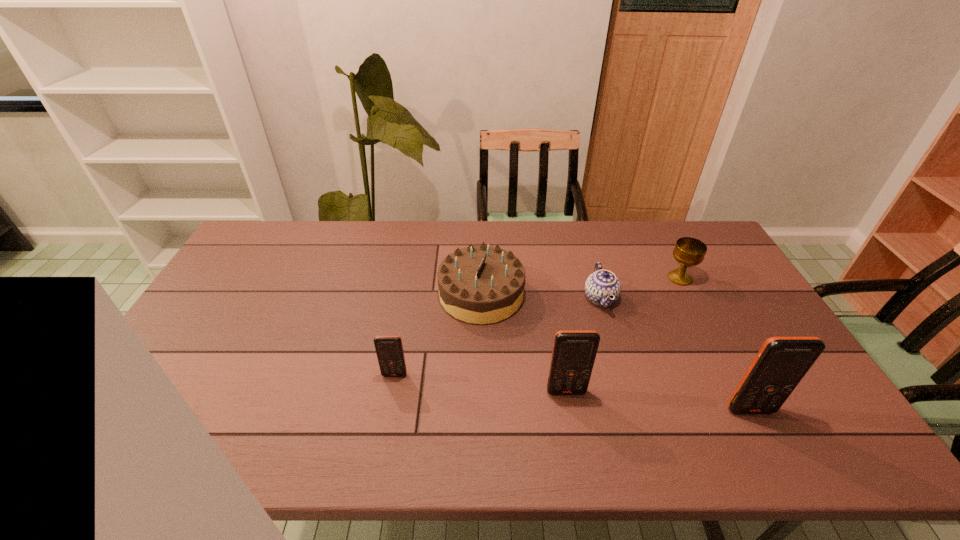
The height and width of the screenshot is (540, 960). Find the location of `free space that satisfies the following two spatial constraints: 1. on the front-facing side of the fifth object from right to left; 2. on the screen of the leftmost cellular telephone`. free space that satisfies the following two spatial constraints: 1. on the front-facing side of the fifth object from right to left; 2. on the screen of the leftmost cellular telephone is located at coordinates (482, 375).

Locate an element on the screen. Image resolution: width=960 pixels, height=540 pixels. vacant space that satisfies the following two spatial constraints: 1. on the front-facing side of the fifth object from right to left; 2. on the screen of the leftmost object is located at coordinates (482, 375).

The image size is (960, 540). In order to click on vacant space that satisfies the following two spatial constraints: 1. on the front side of the chalice; 2. at the spout of the chinaware in this screenshot , I will do `click(689, 298)`.